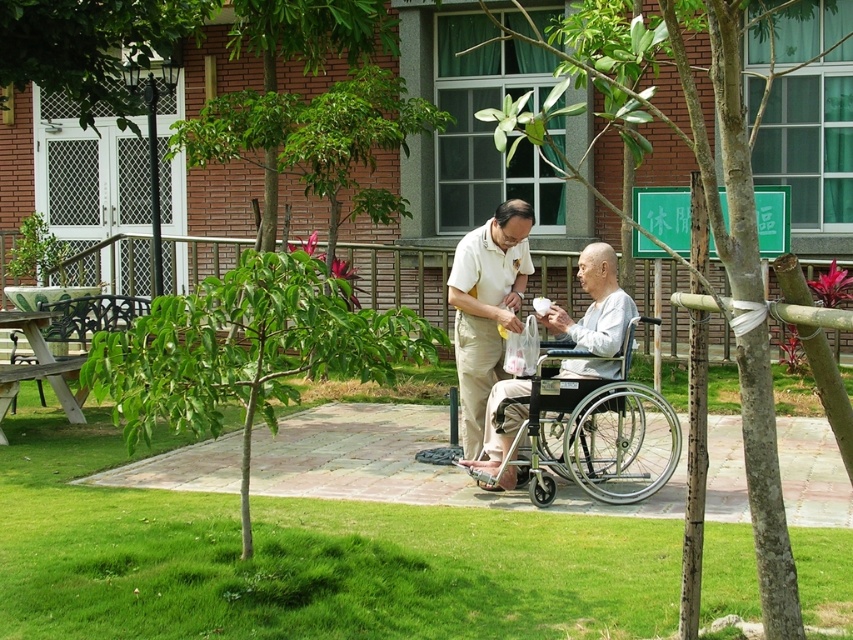
You are a caregiver assisting a person in the white matte shirt at center who needs to move to the silver metallic wheelchair at lower center. Considering the size difference between the two, will the wheelchair accommodate the person comfortably?

The silver metallic wheelchair at lower center has a larger size compared to the white matte shirt at center, so it should comfortably accommodate the person.